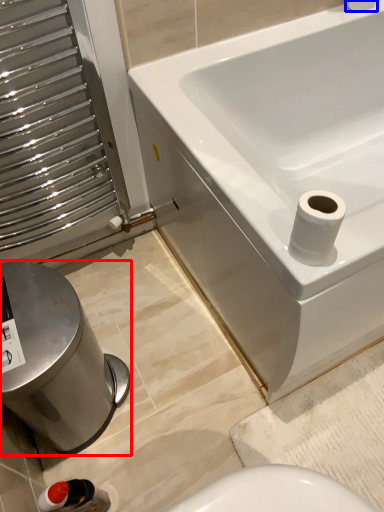
Question: Which object appears closest to the camera in this image, bidet (highlighted by a red box) or toilet paper (highlighted by a blue box)?

Choices:
 (A) bidet
 (B) toilet paper

Answer: (A)